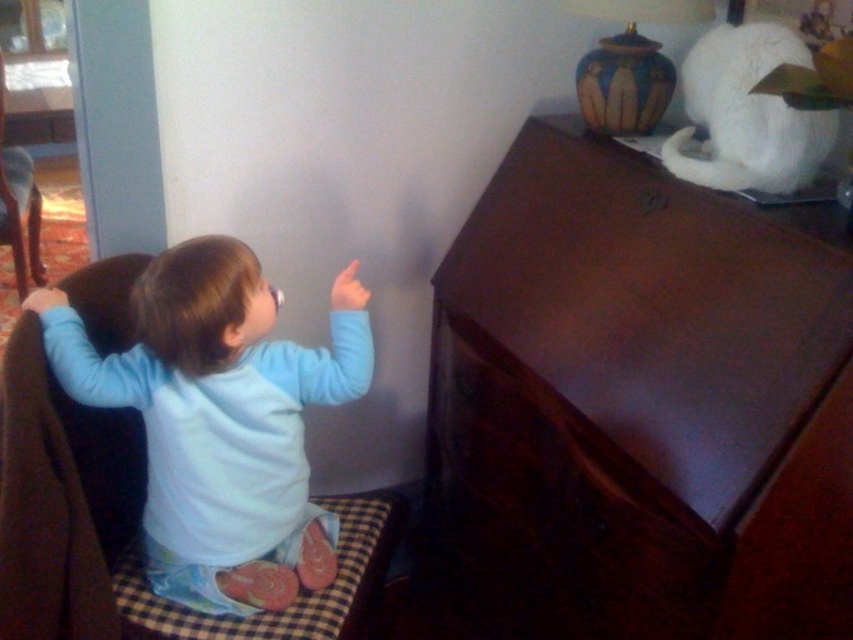
Can you confirm if dark wood dresser at upper right is smaller than dark wood drawer at center?

No.

Between dark wood dresser at upper right and dark wood drawer at center, which one has more height?

dark wood dresser at upper right

Is point (486, 317) farther from camera compared to point (532, 586)?

Yes.

Locate an element on the screen. This screenshot has width=853, height=640. dark wood dresser at upper right is located at coordinates (635, 410).

Is dark wood dresser at upper right further to the viewer compared to light blue fabric at upper left?

That is False.

Which is more to the left, dark wood dresser at upper right or light blue fabric at upper left?

light blue fabric at upper left

Describe the element at coordinates (635, 410) in the screenshot. I see `dark wood dresser at upper right` at that location.

The width and height of the screenshot is (853, 640). Find the location of `dark wood dresser at upper right`. dark wood dresser at upper right is located at coordinates (635, 410).

Does point (183, 561) come farther from viewer compared to point (693, 580)?

Yes.

Which is behind, point (250, 577) or point (454, 403)?

Point (454, 403)

The width and height of the screenshot is (853, 640). Find the location of `light blue fabric at upper left`. light blue fabric at upper left is located at coordinates (219, 420).